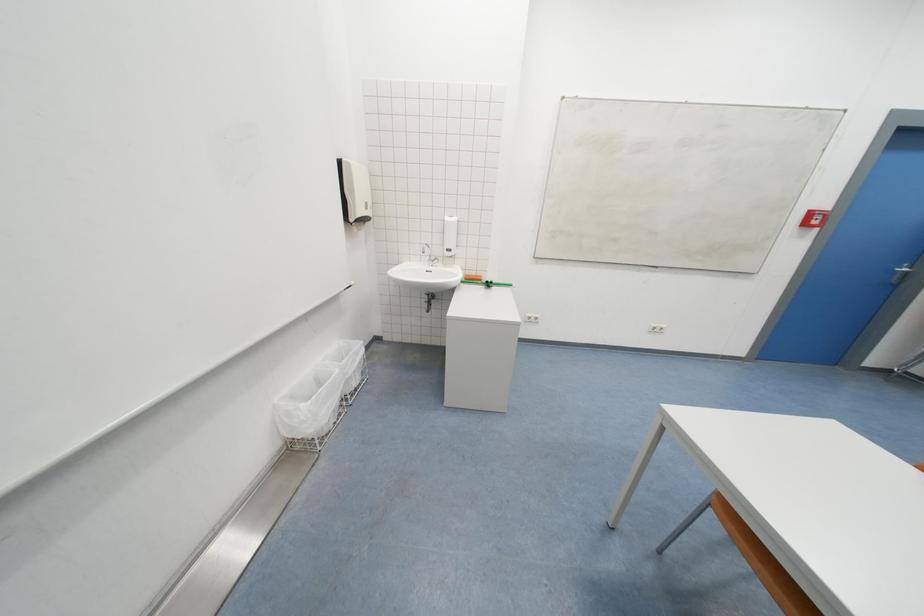
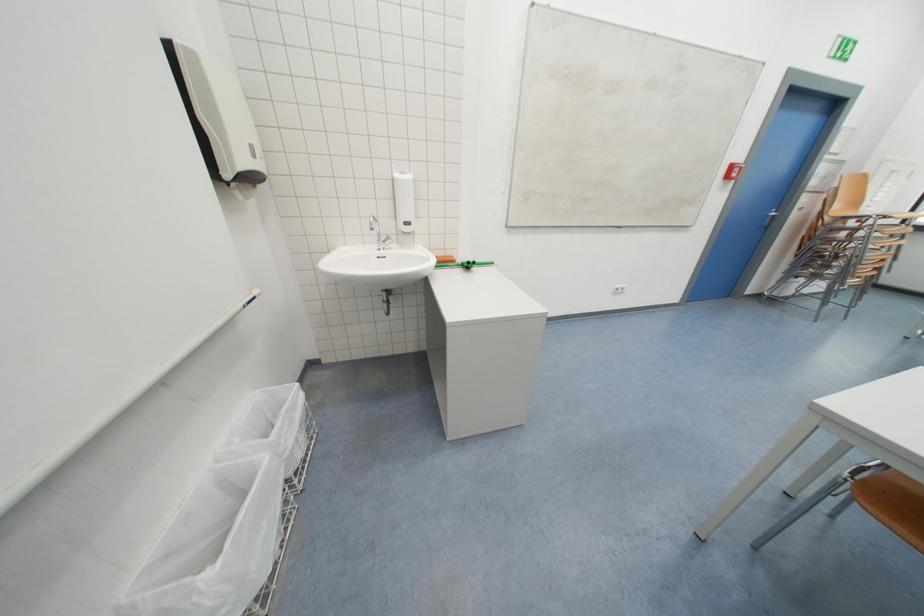
Question: The camera is either moving clockwise (left) or counter-clockwise (right) around the object. The first image is from the beginning of the video and the second image is from the end. Is the camera moving left or right when shooting the video?

Choices:
 (A) Left
 (B) Right

Answer: (A)